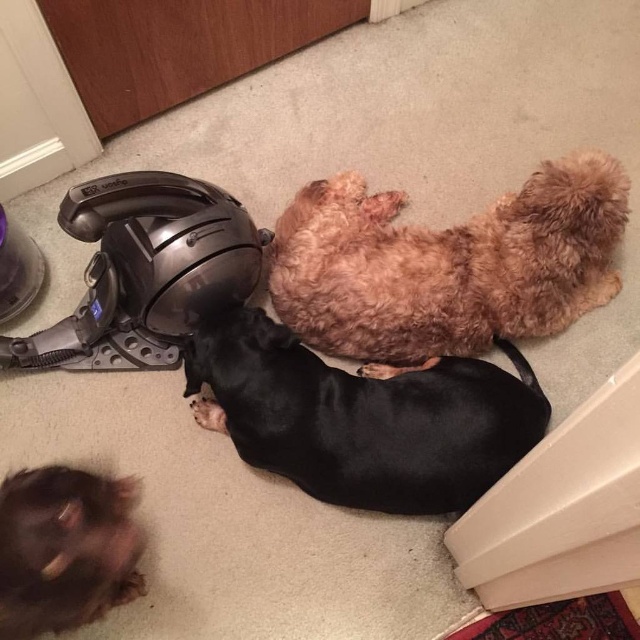
Consider the image. You are standing at the entrance of the room and want to walk towards the point at coordinates point (506, 241). However, there is an obstacle at point (273, 451). Will you encounter the obstacle before reaching your destination?

Yes, you will encounter the obstacle at point (273, 451) before reaching point (506, 241) because point (506, 241) is behind point (273, 451).

You are standing in the room where the black smooth dog at center is located. If you face the direction the dog is looking, which direction would you be facing relative to the room?

The black smooth dog at center is positioned at coordinates 0.653 on the x axis and 0.567 on the y axis. Since the exact direction the dog is facing isn